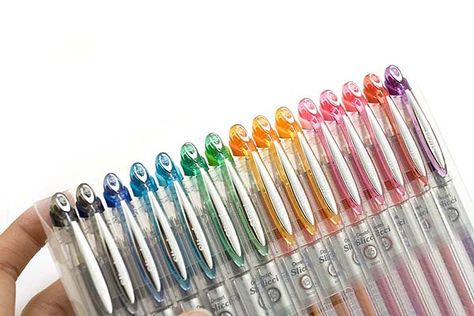
You are a GUI agent. You are given a task and a screenshot of the screen. Output one action in this format:
    pyautogui.click(x=<x>, y=<y>)
    Task: Click on the orange pen
    The image size is (474, 316).
    Given the screenshot: What is the action you would take?
    pyautogui.click(x=246, y=143), pyautogui.click(x=269, y=135), pyautogui.click(x=295, y=121), pyautogui.click(x=263, y=174)